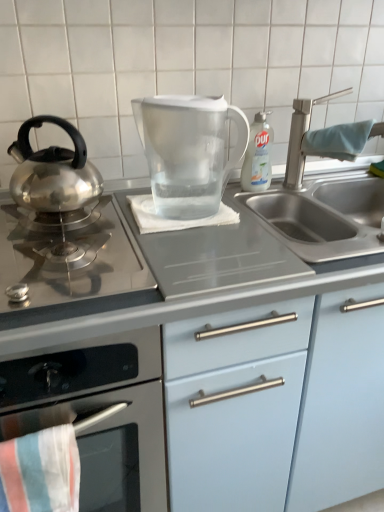
The height and width of the screenshot is (512, 384). What do you see at coordinates (53, 170) in the screenshot? I see `polished stainless steel kettle at left, the second kitchen appliance viewed from the top` at bounding box center [53, 170].

How much space does polished stainless steel kettle at left, the second kitchen appliance viewed from the top, occupy vertically?

polished stainless steel kettle at left, the second kitchen appliance viewed from the top, is 8.58 inches in height.

What is the approximate height of satin silver gas stove at left?

It is 3.77 inches.

Measure the distance between stainless steel kettle at left, the first kitchen appliance in the bottom-to-top sequence, and camera.

stainless steel kettle at left, the first kitchen appliance in the bottom-to-top sequence, and camera are 65.10 centimeters apart from each other.

In order to click on transparent plastic pitcher at center, arranged as the 3th kitchen appliance when ordered from the bottom in this screenshot , I will do `click(188, 151)`.

Where is `white cloth at center, marked as the second beach towel in a right-to-left arrangement`? This screenshot has height=512, width=384. white cloth at center, marked as the second beach towel in a right-to-left arrangement is located at coordinates (173, 219).

The width and height of the screenshot is (384, 512). In order to click on polished stainless steel kettle at left, the second kitchen appliance viewed from the top in this screenshot , I will do `click(53, 170)`.

Which is more to the left, stainless steel kettle at left, the first kitchen appliance in the bottom-to-top sequence, or light blue matte cabinet at center?

stainless steel kettle at left, the first kitchen appliance in the bottom-to-top sequence, is more to the left.

Is stainless steel kettle at left, the first kitchen appliance in the bottom-to-top sequence, closer to the viewer compared to light blue matte cabinet at center?

No, the depth of stainless steel kettle at left, the first kitchen appliance in the bottom-to-top sequence, is greater than that of light blue matte cabinet at center.

At what (x,y) coordinates should I click in order to perform the action: click on cabinetry lying in front of the stainless steel kettle at left, which ranks as the third kitchen appliance in top-to-bottom order. Please return your answer as a coordinate pair (x, y). The height and width of the screenshot is (512, 384). Looking at the image, I should click on (x=210, y=360).

From the image's perspective, is stainless steel kettle at left, the first kitchen appliance in the bottom-to-top sequence, located above or below light blue matte cabinet at center?

Clearly, from the image's perspective, stainless steel kettle at left, the first kitchen appliance in the bottom-to-top sequence, is below light blue matte cabinet at center.

Considering the relative positions of polished stainless steel kettle at left, which ranks as the 2th kitchen appliance in bottom-to-top order, and satin silver gas stove at left in the image provided, is polished stainless steel kettle at left, which ranks as the 2th kitchen appliance in bottom-to-top order, to the left of satin silver gas stove at left from the viewer's perspective?

Yes.

From the image's perspective, does polished stainless steel kettle at left, which ranks as the 2th kitchen appliance in bottom-to-top order, appear higher than satin silver gas stove at left?

Indeed, from the image's perspective, polished stainless steel kettle at left, which ranks as the 2th kitchen appliance in bottom-to-top order, is shown above satin silver gas stove at left.

Does polished stainless steel kettle at left, which ranks as the 2th kitchen appliance in bottom-to-top order, have a lesser height compared to satin silver gas stove at left?

No.

Can you confirm if polished stainless steel kettle at left, the second kitchen appliance viewed from the top, is bigger than satin silver gas stove at left?

Actually, polished stainless steel kettle at left, the second kitchen appliance viewed from the top, might be smaller than satin silver gas stove at left.

Is light blue matte cabinet at center next to satin silver gas stove at left?

No, light blue matte cabinet at center is not making contact with satin silver gas stove at left.

From the picture: Is light blue matte cabinet at center closer to camera compared to satin silver gas stove at left?

Yes.

How distant is light blue matte cabinet at center from satin silver gas stove at left?

light blue matte cabinet at center is 12.49 inches from satin silver gas stove at left.

From the image's perspective, which is above, light blue matte cabinet at center or satin silver gas stove at left?

From the image's view, satin silver gas stove at left is above.

Can you confirm if stainless steel kettle at left, the first kitchen appliance in the bottom-to-top sequence, is shorter than blue fabric towel at sink right, which ranks as the first beach towel in top-to-bottom order?

Incorrect, the height of stainless steel kettle at left, the first kitchen appliance in the bottom-to-top sequence, does not fall short of that of blue fabric towel at sink right, which ranks as the first beach towel in top-to-bottom order.

From the picture: Measure the distance between stainless steel kettle at left, the first kitchen appliance in the bottom-to-top sequence, and blue fabric towel at sink right, which ranks as the first beach towel in top-to-bottom order.

stainless steel kettle at left, the first kitchen appliance in the bottom-to-top sequence, is 31.00 inches from blue fabric towel at sink right, which ranks as the first beach towel in top-to-bottom order.

Is stainless steel kettle at left, the first kitchen appliance in the bottom-to-top sequence, positioned far away from blue fabric towel at sink right, which ranks as the 3th beach towel in left-to-right order?

That's not correct — stainless steel kettle at left, the first kitchen appliance in the bottom-to-top sequence, is a little close to blue fabric towel at sink right, which ranks as the 3th beach towel in left-to-right order.

From a real-world perspective, is stainless steel kettle at left, the first kitchen appliance in the bottom-to-top sequence, positioned under blue fabric towel at sink right, which is counted as the third beach towel, starting from the bottom, based on gravity?

Yes, from a real-world perspective, stainless steel kettle at left, the first kitchen appliance in the bottom-to-top sequence, is under blue fabric towel at sink right, which is counted as the third beach towel, starting from the bottom.

Is satin nickel faucet at upper right situated inside polished stainless steel kettle at left, which ranks as the 2th kitchen appliance in bottom-to-top order, or outside?

satin nickel faucet at upper right lies outside polished stainless steel kettle at left, which ranks as the 2th kitchen appliance in bottom-to-top order.

Visually, is satin nickel faucet at upper right positioned to the left or to the right of polished stainless steel kettle at left, the second kitchen appliance viewed from the top?

In the image, satin nickel faucet at upper right appears on the right side of polished stainless steel kettle at left, the second kitchen appliance viewed from the top.

Which of these two, satin nickel faucet at upper right or polished stainless steel kettle at left, the second kitchen appliance viewed from the top, is wider?

polished stainless steel kettle at left, the second kitchen appliance viewed from the top.

Is there a large distance between satin nickel faucet at upper right and polished stainless steel kettle at left, the second kitchen appliance viewed from the top?

No, satin nickel faucet at upper right is not far from polished stainless steel kettle at left, the second kitchen appliance viewed from the top.

Does light blue matte cabinet at center have a lesser width compared to white cloth at center, marked as the second beach towel in a right-to-left arrangement?

In fact, light blue matte cabinet at center might be wider than white cloth at center, marked as the second beach towel in a right-to-left arrangement.

From the image's perspective, who appears lower, light blue matte cabinet at center or white cloth at center, marked as the second beach towel in a right-to-left arrangement?

light blue matte cabinet at center appears lower in the image.

Considering the relative sizes of light blue matte cabinet at center and white cloth at center, marked as the second beach towel in a right-to-left arrangement, in the image provided, is light blue matte cabinet at center bigger than white cloth at center, marked as the second beach towel in a right-to-left arrangement,?

Indeed, light blue matte cabinet at center has a larger size compared to white cloth at center, marked as the second beach towel in a right-to-left arrangement.

From a real-world perspective, is light blue matte cabinet at center under white cloth at center, acting as the second beach towel starting from the bottom?

Yes, from a real-world perspective, light blue matte cabinet at center is under white cloth at center, acting as the second beach towel starting from the bottom.

Considering the relative sizes of striped cotton beach towel at lower left, placed as the 3th beach towel when sorted from right to left, and blue fabric towel at sink right, which is counted as the third beach towel, starting from the bottom, in the image provided, is striped cotton beach towel at lower left, placed as the 3th beach towel when sorted from right to left, taller than blue fabric towel at sink right, which is counted as the third beach towel, starting from the bottom,?

Indeed, striped cotton beach towel at lower left, placed as the 3th beach towel when sorted from right to left, has a greater height compared to blue fabric towel at sink right, which is counted as the third beach towel, starting from the bottom.

Which is nearer, (35,510) or (359,140)?

Point (35,510)

Could you tell me if striped cotton beach towel at lower left, the first beach towel viewed from the left, is turned towards blue fabric towel at sink right, the 3th beach towel in the front-to-back sequence?

No.

Is there a large distance between striped cotton beach towel at lower left, marked as the first beach towel in a bottom-to-top arrangement, and blue fabric towel at sink right, which ranks as the 3th beach towel in left-to-right order?

That's not correct — striped cotton beach towel at lower left, marked as the first beach towel in a bottom-to-top arrangement, is a little close to blue fabric towel at sink right, which ranks as the 3th beach towel in left-to-right order.

Image resolution: width=384 pixels, height=512 pixels. What are the coordinates of `the 1st kitchen appliance behind the light blue matte cabinet at center, starting your count from the anchor` in the screenshot? It's located at point(98,414).

Where is `gas stove on the right of the polished stainless steel kettle at left, which ranks as the 2th kitchen appliance in bottom-to-top order`? gas stove on the right of the polished stainless steel kettle at left, which ranks as the 2th kitchen appliance in bottom-to-top order is located at coordinates [70, 263].

Consider the image. Based on their spatial positions, is stainless steel kettle at left, which ranks as the third kitchen appliance in top-to-bottom order, or striped cotton beach towel at lower left, the 1th beach towel positioned from the front, further from white cloth at center, acting as the second beach towel starting from the bottom?

striped cotton beach towel at lower left, the 1th beach towel positioned from the front, is positioned further to the anchor white cloth at center, acting as the second beach towel starting from the bottom.

In the scene shown: Based on their spatial positions, is satin nickel faucet at upper right or satin silver gas stove at left further from blue fabric towel at sink right, the 3th beach towel in the front-to-back sequence?

Based on the image, satin silver gas stove at left appears to be further to blue fabric towel at sink right, the 3th beach towel in the front-to-back sequence.

Looking at the image, which one is located further to clear plastic bottle at upper right, light blue matte cabinet at center or blue fabric towel at sink right, which ranks as the 3th beach towel in left-to-right order?

The object further to clear plastic bottle at upper right is light blue matte cabinet at center.

Based on their spatial positions, is striped cotton beach towel at lower left, the 1th beach towel positioned from the front, or satin silver gas stove at left further from satin nickel faucet at upper right?

Among the two, striped cotton beach towel at lower left, the 1th beach towel positioned from the front, is located further to satin nickel faucet at upper right.

In the scene shown: From the image, which object appears to be nearer to blue fabric towel at sink right, the first beach towel when ordered from back to front, white cloth at center, marked as the second beach towel in a right-to-left arrangement, or satin silver gas stove at left?

Based on the image, white cloth at center, marked as the second beach towel in a right-to-left arrangement, appears to be nearer to blue fabric towel at sink right, the first beach towel when ordered from back to front.

From the image, which object appears to be farther from stainless steel kettle at left, which ranks as the third kitchen appliance in top-to-bottom order, satin nickel faucet at upper right or light blue matte cabinet at center?

satin nickel faucet at upper right is positioned further to the anchor stainless steel kettle at left, which ranks as the third kitchen appliance in top-to-bottom order.

Estimate the real-world distances between objects in this image. Which object is closer to stainless steel kettle at left, the first kitchen appliance in the bottom-to-top sequence, satin nickel faucet at upper right or striped cotton beach towel at lower left, which is the 3th beach towel from back to front?

striped cotton beach towel at lower left, which is the 3th beach towel from back to front.

Which object lies further to the anchor point light blue matte cabinet at center, transparent plastic pitcher at center, arranged as the 3th kitchen appliance when ordered from the bottom, or striped cotton beach towel at lower left, which is the 3th beach towel from back to front?

striped cotton beach towel at lower left, which is the 3th beach towel from back to front, lies further to light blue matte cabinet at center than the other object.

Identify the location of beach towel between transparent plastic pitcher at center, which is counted as the 1th kitchen appliance, starting from the top, and striped cotton beach towel at lower left, the 1th beach towel positioned from the front, in the vertical direction. Image resolution: width=384 pixels, height=512 pixels. (x=173, y=219).

You are a GUI agent. You are given a task and a screenshot of the screen. Output one action in this format:
    pyautogui.click(x=<x>, y=<y>)
    Task: Click on the cabinetry between clear plastic bottle at upper right and stainless steel kettle at left, which ranks as the third kitchen appliance in top-to-bottom order, in the vertical direction
    
    Given the screenshot: What is the action you would take?
    (210, 360)

You are a GUI agent. You are given a task and a screenshot of the screen. Output one action in this format:
    pyautogui.click(x=<x>, y=<y>)
    Task: Click on the cabinetry between satin nickel faucet at upper right and striped cotton beach towel at lower left, the first beach towel viewed from the left, from top to bottom
    Image resolution: width=384 pixels, height=512 pixels.
    Given the screenshot: What is the action you would take?
    pyautogui.click(x=210, y=360)

Where is `cabinetry between transparent plastic pitcher at center, arranged as the 3th kitchen appliance when ordered from the bottom, and striped cotton beach towel at lower left, marked as the first beach towel in a bottom-to-top arrangement, in the vertical direction`? The height and width of the screenshot is (512, 384). cabinetry between transparent plastic pitcher at center, arranged as the 3th kitchen appliance when ordered from the bottom, and striped cotton beach towel at lower left, marked as the first beach towel in a bottom-to-top arrangement, in the vertical direction is located at coordinates (210, 360).